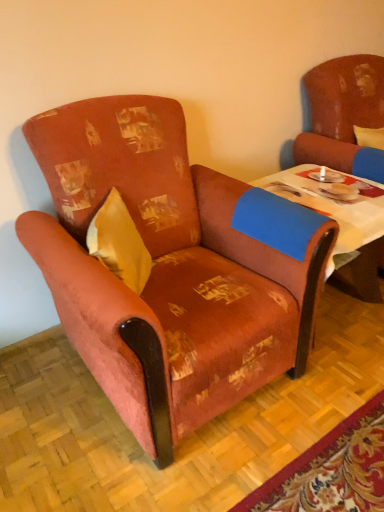
Question: In terms of size, does distressed brown armchair at right, the 2th chair viewed from the left, appear bigger or smaller than yellow fabric pillow at left?

Choices:
 (A) small
 (B) big

Answer: (B)

Question: From a real-world perspective, relative to yellow fabric pillow at left, is distressed brown armchair at right, placed as the first chair when sorted from right to left, vertically above or below?

Choices:
 (A) above
 (B) below

Answer: (B)

Question: Based on their relative distances, which object is farther from the distressed brown armchair at right, placed as the first chair when sorted from right to left?

Choices:
 (A) yellow fabric pillow at left
 (B) textured orange armchair at left, which is the first chair from left to right
 (C) blue fabric table at center

Answer: (A)

Question: Estimate the real-world distances between objects in this image. Which object is farther from the blue fabric table at center?

Choices:
 (A) textured orange armchair at left, the second chair from the right
 (B) yellow fabric pillow at left
 (C) distressed brown armchair at right, the 2th chair viewed from the left

Answer: (B)